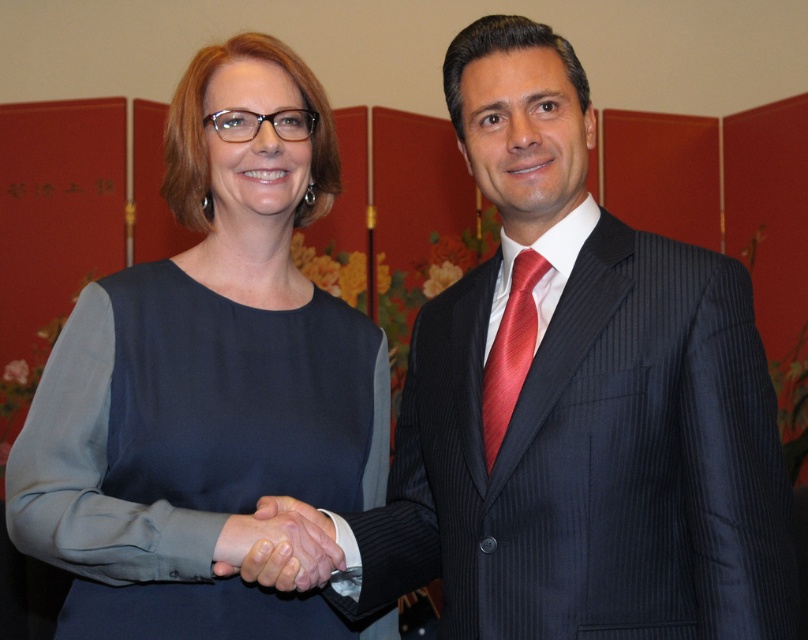
Question: Which object appears closest to the camera in this image?

Choices:
 (A) smooth black suit at center
 (B) shiny red tie at center

Answer: (A)

Question: Which object is positioned closest to the smooth skin handshake at center?

Choices:
 (A) smooth black suit at center
 (B) shiny red tie at center

Answer: (B)

Question: Does smooth black suit at center appear over smooth skin handshake at center?

Choices:
 (A) yes
 (B) no

Answer: (A)

Question: Does smooth black suit at center come in front of matte black dress at center?

Choices:
 (A) yes
 (B) no

Answer: (A)

Question: Is matte black dress at center positioned in front of smooth skin handshake at center?

Choices:
 (A) no
 (B) yes

Answer: (A)

Question: Which point is farther to the camera?

Choices:
 (A) (486, 412)
 (B) (271, 540)

Answer: (A)